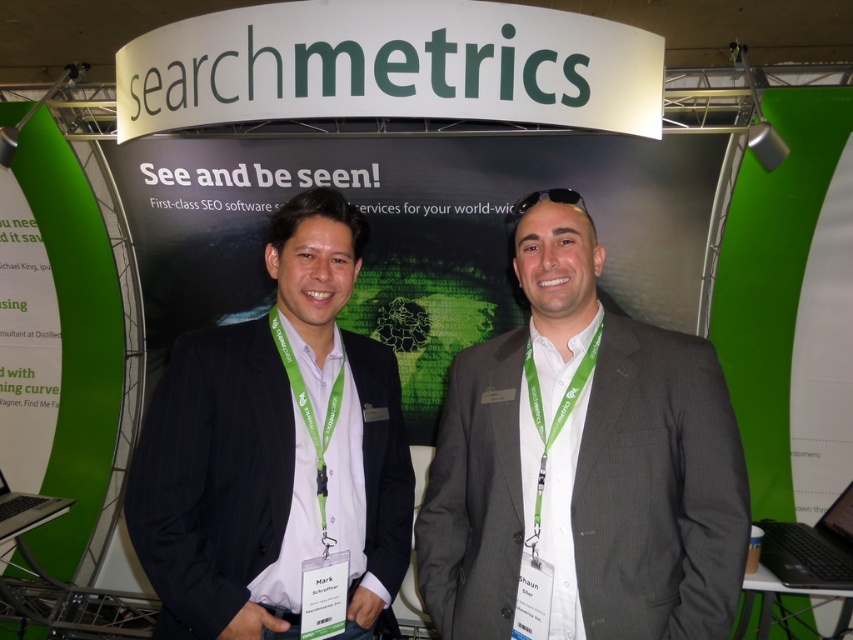
Does gray pinstripe suit at center have a greater width compared to silver metallic laptop at lower left?

Yes, gray pinstripe suit at center is wider than silver metallic laptop at lower left.

Between gray pinstripe suit at center and silver metallic laptop at lower left, which one is positioned higher?

gray pinstripe suit at center is above.

Describe the element at coordinates (583, 464) in the screenshot. This screenshot has width=853, height=640. I see `gray pinstripe suit at center` at that location.

Locate an element on the screen. Image resolution: width=853 pixels, height=640 pixels. gray pinstripe suit at center is located at coordinates (583, 464).

Is gray pinstripe suit at center above black plastic laptop at lower right?

Yes.

Which is behind, point (688, 408) or point (837, 552)?

Point (837, 552)

Is point (434, 561) less distant than point (811, 538)?

Yes, it is in front of point (811, 538).

Where is `gray pinstripe suit at center`? The height and width of the screenshot is (640, 853). gray pinstripe suit at center is located at coordinates (583, 464).

Does point (131, 515) lie behind point (764, 563)?

No, (131, 515) is in front of (764, 563).

Is dark blue suit at center wider than black plastic laptop at lower right?

Yes, dark blue suit at center is wider than black plastic laptop at lower right.

Which is in front, point (398, 467) or point (845, 561)?

Positioned in front is point (398, 467).

Locate an element on the screen. dark blue suit at center is located at coordinates (274, 451).